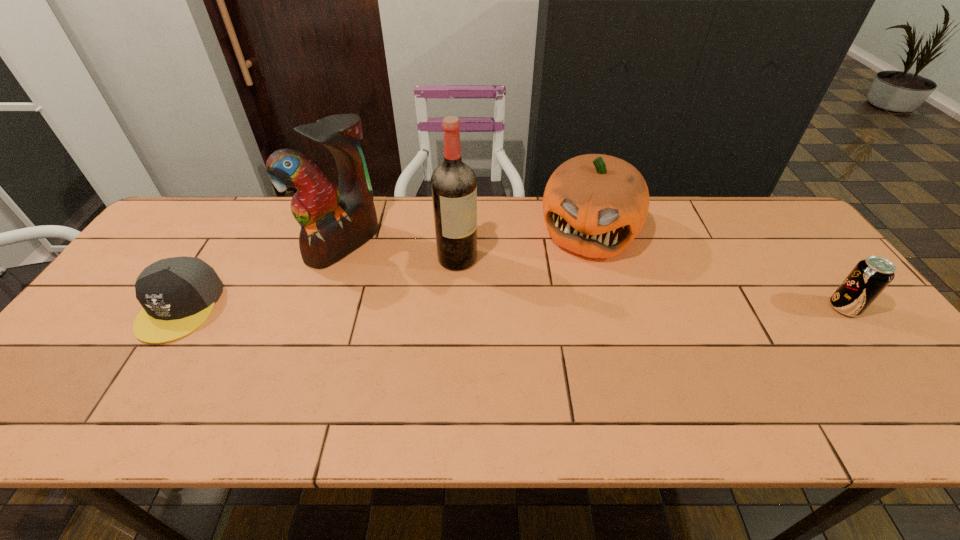
Where is `free space on the desktop that is between the leftmost object and the rightmost object and is positioned on the face of the third shortest object`? The image size is (960, 540). free space on the desktop that is between the leftmost object and the rightmost object and is positioned on the face of the third shortest object is located at coordinates 562,307.

Where is `vacant space on the desktop that is between the leftmost object and the fourth tallest object and is positioned on the front-facing side of the third object from right to left`? vacant space on the desktop that is between the leftmost object and the fourth tallest object and is positioned on the front-facing side of the third object from right to left is located at coordinates (522, 307).

Find the location of `vacant spot on the desktop that is between the cap and the rightmost object and is positioned at the face of the fourth object from right to left`. vacant spot on the desktop that is between the cap and the rightmost object and is positioned at the face of the fourth object from right to left is located at coordinates (436, 307).